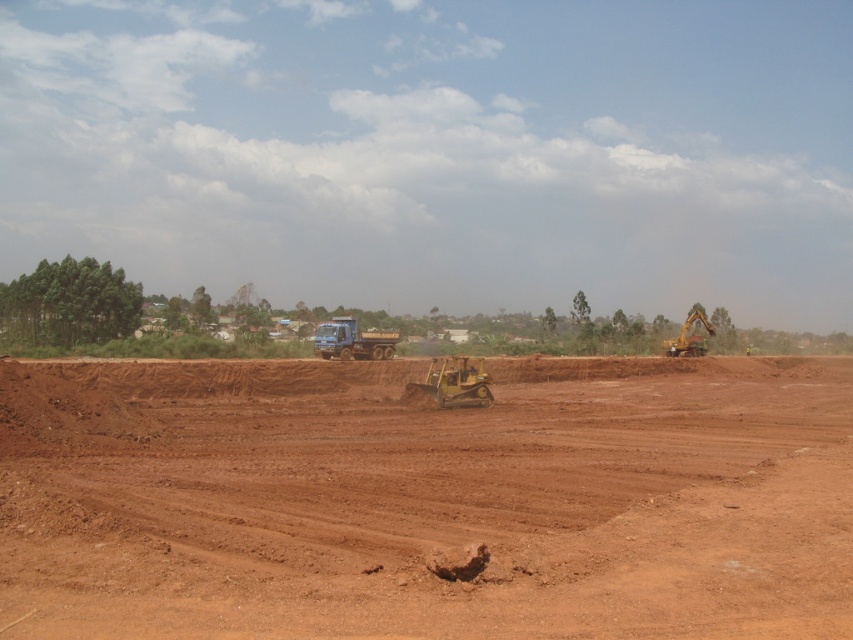
Question: Which is nearer to the brown dirt field at center?

Choices:
 (A) yellow rubber tracked vehicle at center
 (B) yellow metallic excavator at right
 (C) blue metallic truck at center

Answer: (A)

Question: Which point appears farthest from the camera in this image?

Choices:
 (A) (459, 387)
 (B) (351, 320)
 (C) (698, 337)

Answer: (C)

Question: Estimate the real-world distances between objects in this image. Which object is farther from the yellow rubber tracked vehicle at center?

Choices:
 (A) brown dirt field at center
 (B) yellow metallic excavator at right
 (C) blue metallic truck at center

Answer: (B)

Question: Is brown dirt field at center smaller than yellow metallic excavator at right?

Choices:
 (A) no
 (B) yes

Answer: (A)

Question: Is brown dirt field at center to the right of yellow metallic excavator at right from the viewer's perspective?

Choices:
 (A) yes
 (B) no

Answer: (B)

Question: Is brown dirt field at center further to camera compared to yellow metallic excavator at right?

Choices:
 (A) yes
 (B) no

Answer: (B)